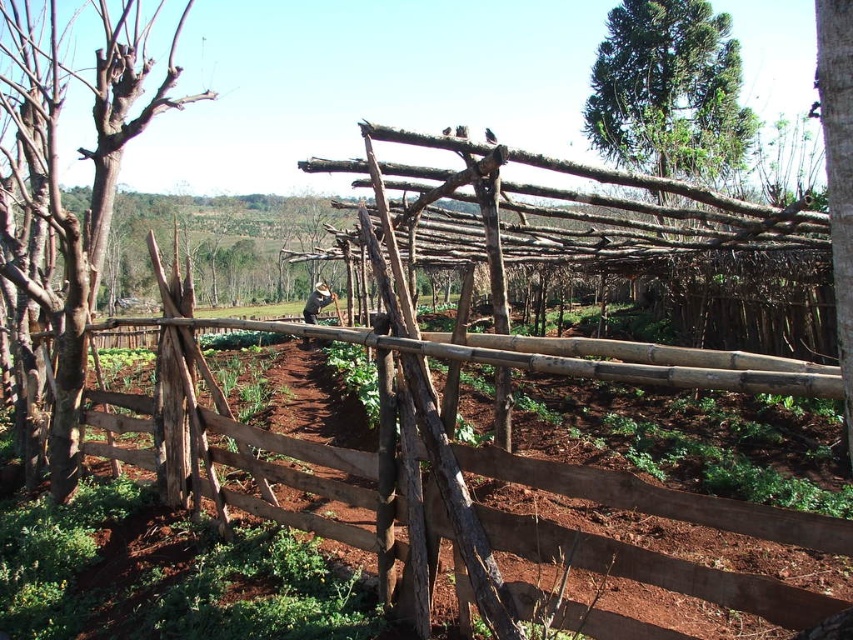
Where is `green textured tree at upper right`? This screenshot has width=853, height=640. green textured tree at upper right is located at coordinates (668, 90).

Does point (589, 100) come closer to viewer compared to point (309, 300)?

No, (589, 100) is further to viewer.

Is point (670, 156) positioned in front of point (315, 340)?

No, (670, 156) is behind (315, 340).

This screenshot has height=640, width=853. I want to click on green textured tree at upper right, so click(x=668, y=90).

Between brown wooden fence at center and brown rough bark tree at right, which one appears on the right side from the viewer's perspective?

From the viewer's perspective, brown rough bark tree at right appears more on the right side.

Which is below, brown wooden fence at center or brown rough bark tree at right?

brown wooden fence at center is lower down.

What do you see at coordinates (467, 470) in the screenshot?
I see `brown wooden fence at center` at bounding box center [467, 470].

The height and width of the screenshot is (640, 853). In order to click on brown wooden fence at center in this screenshot , I will do `click(467, 470)`.

Can you confirm if brown rough bark tree at right is positioned to the left of brown wooden man at center?

In fact, brown rough bark tree at right is to the right of brown wooden man at center.

Measure the distance between brown rough bark tree at right and brown wooden man at center.

brown rough bark tree at right is 12.64 meters from brown wooden man at center.

I want to click on brown rough bark tree at right, so click(x=838, y=168).